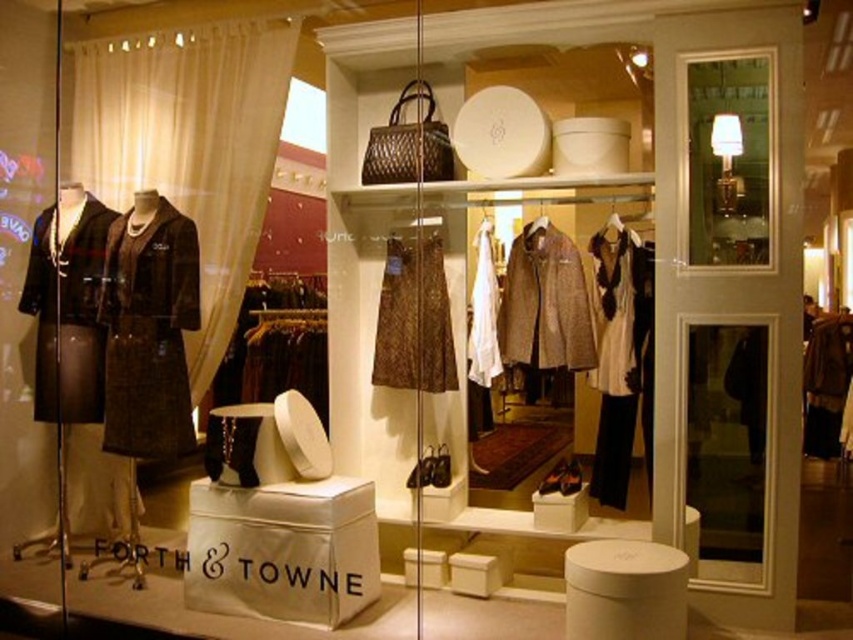
Question: Which of the following is the farthest from the observer?

Choices:
 (A) (727, 150)
 (B) (62, 413)
 (C) (480, 307)
 (D) (109, 368)

Answer: (C)

Question: Is beige fabric curtain at left below brown textured coat at left?

Choices:
 (A) yes
 (B) no

Answer: (B)

Question: Can you confirm if brown tweed coat at center is positioned to the left of brown textured dress at center?

Choices:
 (A) yes
 (B) no

Answer: (B)

Question: From the image, what is the correct spatial relationship of brown textured coat at left in relation to brown textured dress at center?

Choices:
 (A) left
 (B) right

Answer: (A)

Question: Among these points, which one is nearest to the camera?

Choices:
 (A) (415, 301)
 (B) (68, 292)
 (C) (477, 292)
 (D) (596, 460)

Answer: (D)

Question: Among these objects, which one is farthest from the camera?

Choices:
 (A) matte brown coat at left
 (B) brown tweed coat at center
 (C) brown textured dress at center
 (D) white cotton dress at center

Answer: (C)